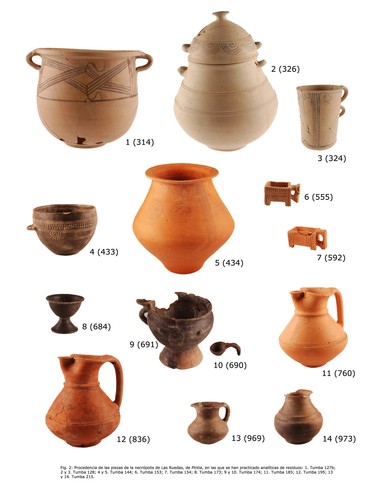
Locate an element on the screen. This screenshot has height=500, width=376. brown vase on uppr left is located at coordinates (87, 116).